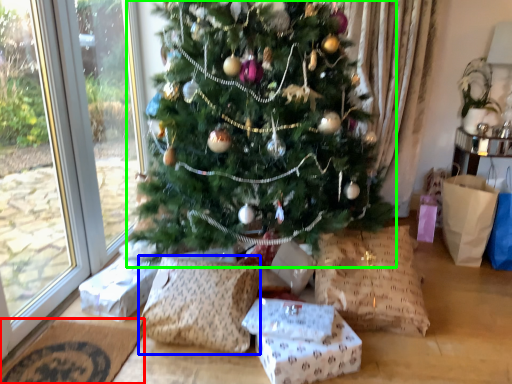
Question: Which object is the farthest from doormat (highlighted by a red box)? Choose among these: pillow (highlighted by a blue box) or christmas tree (highlighted by a green box).

Choices:
 (A) pillow
 (B) christmas tree

Answer: (B)